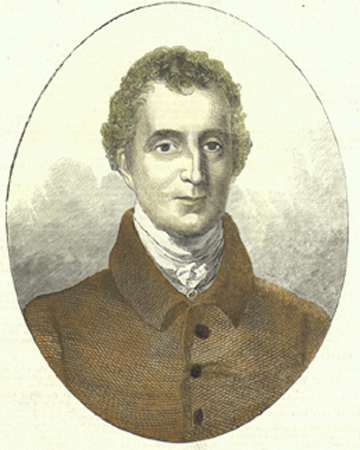
Locate an element on the screen. ivory white background color is located at coordinates (168, 22).